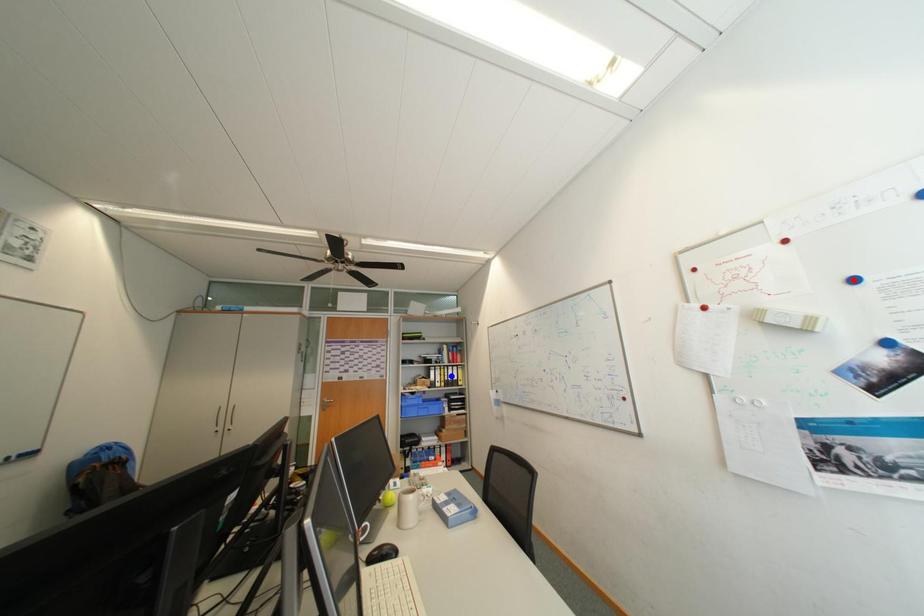
Question: In the image, two points are highlighted. Which point is nearer to the camera? Reply with the corresponding letter.

Choices:
 (A) blue point
 (B) red point

Answer: (B)